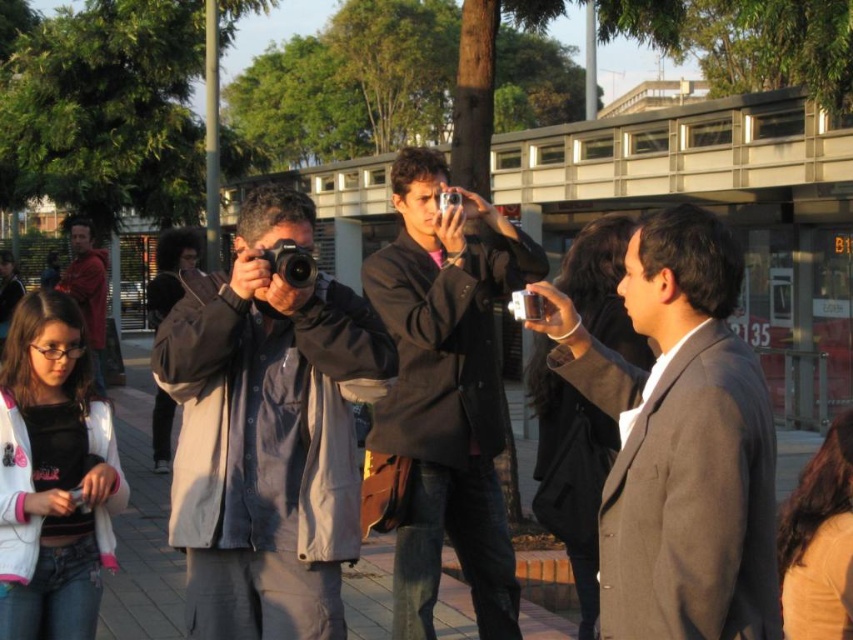
Question: Estimate the real-world distances between objects in this image. Which object is closer to the dark brown leather jacket at center?

Choices:
 (A) black plastic camera at center
 (B) metallic silver camera at center
 (C) gray fabric jacket at center
 (D) gray woolen suit at right

Answer: (C)

Question: Is gray fabric jacket at center bigger than dark brown leather jacket at center?

Choices:
 (A) yes
 (B) no

Answer: (B)

Question: Which is farther from the metallic silver camera at center?

Choices:
 (A) dark brown leather jacket at center
 (B) gray woolen suit at right
 (C) silver metallic camera at center

Answer: (A)

Question: In this image, where is gray woolen suit at right located relative to metallic silver camera at center?

Choices:
 (A) left
 (B) right

Answer: (B)

Question: Which point appears farthest from the camera in this image?

Choices:
 (A) (312, 278)
 (B) (314, 300)
 (C) (102, 300)

Answer: (C)

Question: From the image, what is the correct spatial relationship of dark brown leather jacket at center in relation to black plastic camera at center?

Choices:
 (A) right
 (B) left

Answer: (A)